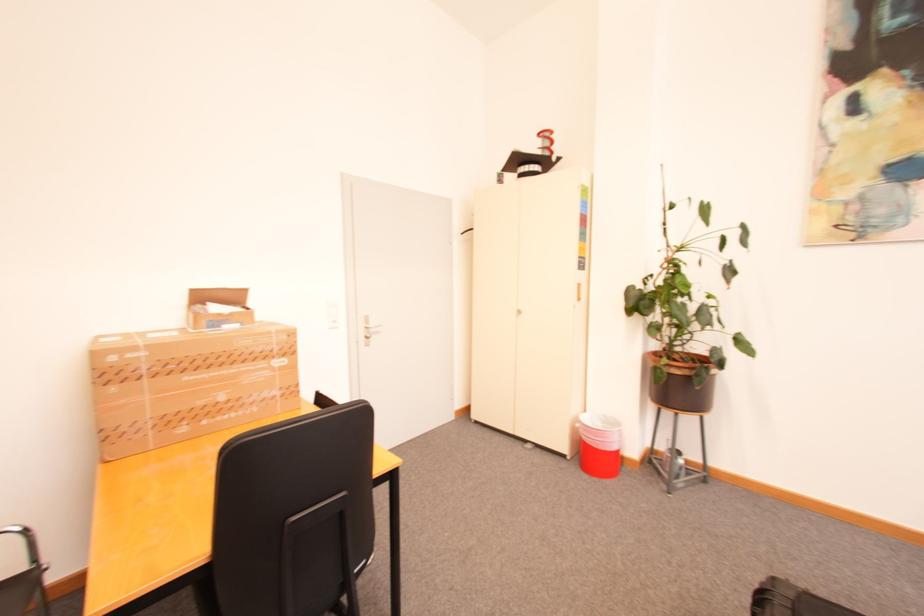
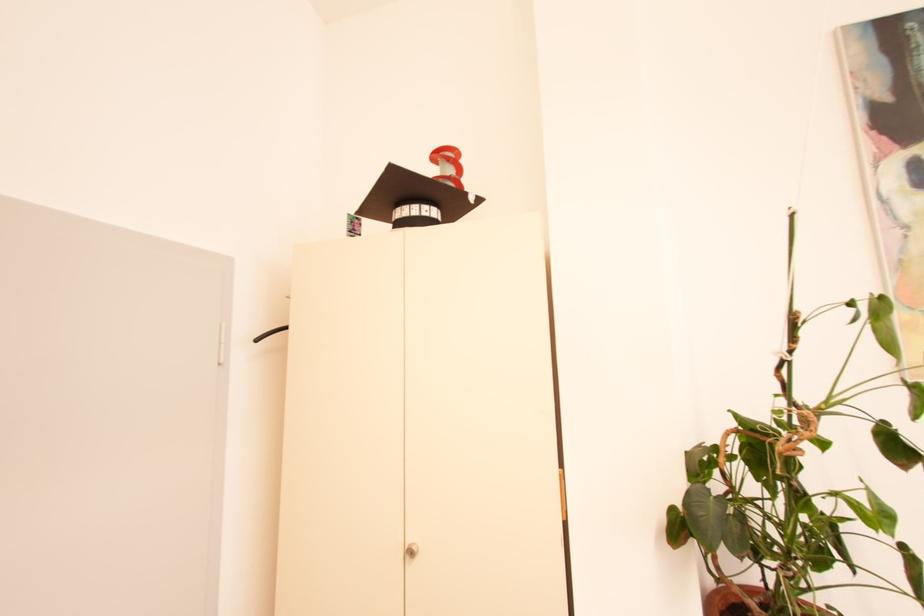
Where in the second image is the point corresponding to point 561,160 from the first image?

(478, 199)